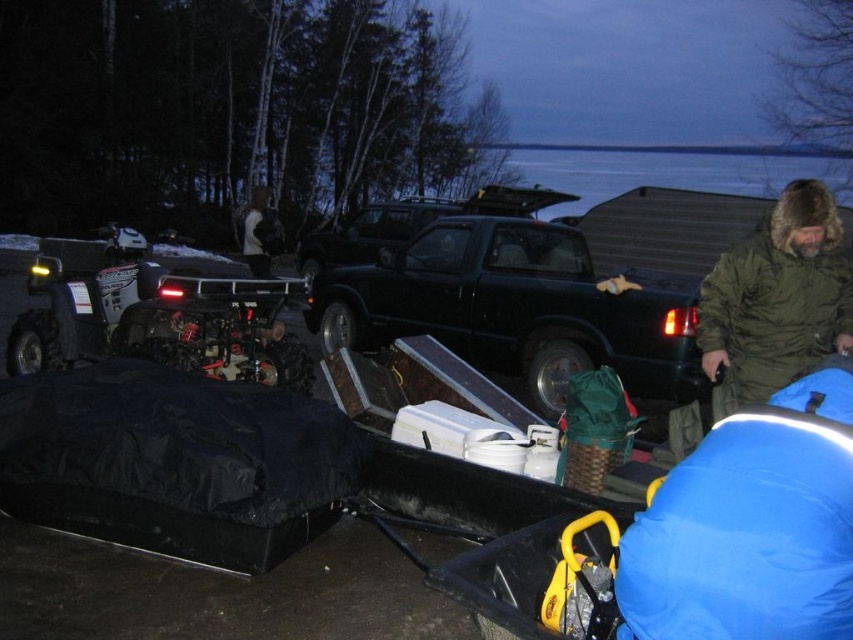
Which is behind, point (49, 292) or point (801, 257)?

Point (49, 292)

Who is more distant from viewer, (122, 342) or (763, 305)?

Point (122, 342)

Locate an element on the screen. The image size is (853, 640). black matte quad bike at left is located at coordinates (158, 320).

Can you confirm if black matte quad bike at left is wider than dark brown fur coat at upper center?

Yes, black matte quad bike at left is wider than dark brown fur coat at upper center.

Can you confirm if black matte quad bike at left is smaller than dark brown fur coat at upper center?

Incorrect, black matte quad bike at left is not smaller in size than dark brown fur coat at upper center.

Between point (103, 256) and point (248, 256), which one is positioned behind?

Positioned behind is point (248, 256).

Find the location of a particular element. This screenshot has width=853, height=640. black matte quad bike at left is located at coordinates (158, 320).

From the picture: Can you confirm if green fuzzy coat at right is wider than dark brown fur coat at upper center?

Yes, green fuzzy coat at right is wider than dark brown fur coat at upper center.

Can you confirm if green fuzzy coat at right is positioned to the left of dark brown fur coat at upper center?

No, green fuzzy coat at right is not to the left of dark brown fur coat at upper center.

Find the location of `green fuzzy coat at right`. green fuzzy coat at right is located at coordinates (778, 296).

At what (x,y) coordinates should I click in order to perform the action: click on green fuzzy coat at right. Please return your answer as a coordinate pair (x, y). The width and height of the screenshot is (853, 640). Looking at the image, I should click on (778, 296).